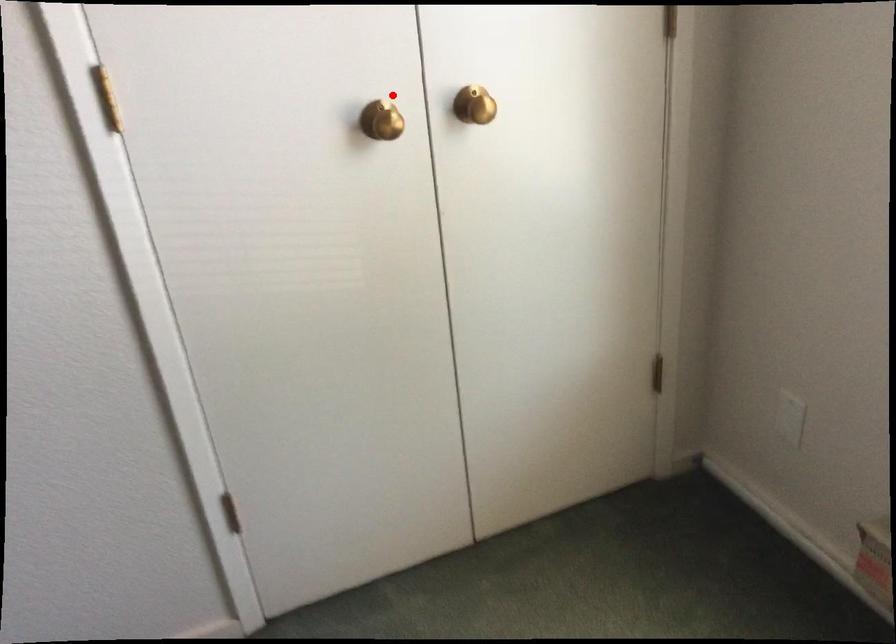
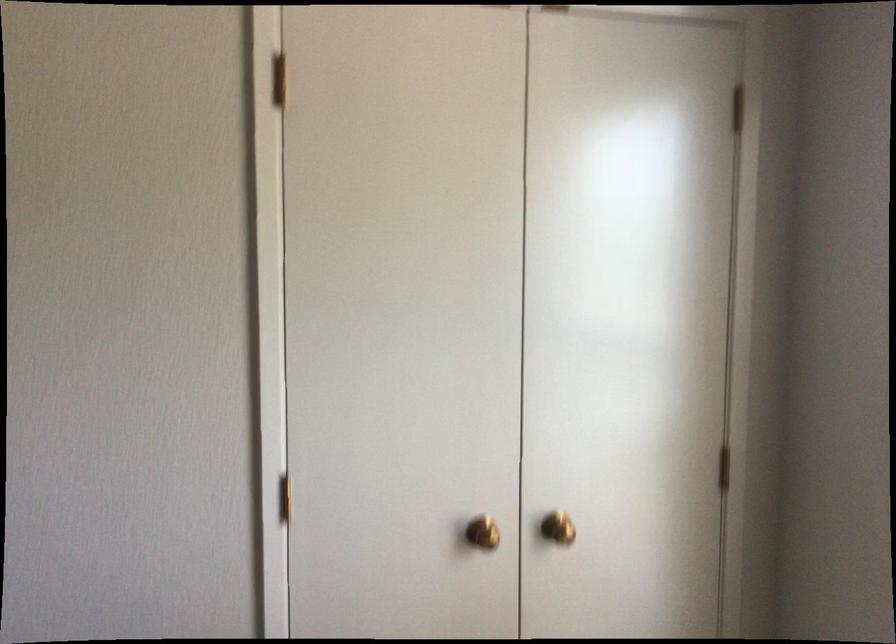
The point at the highlighted location is marked in the first image. Where is the corresponding point in the second image?

(483, 533)